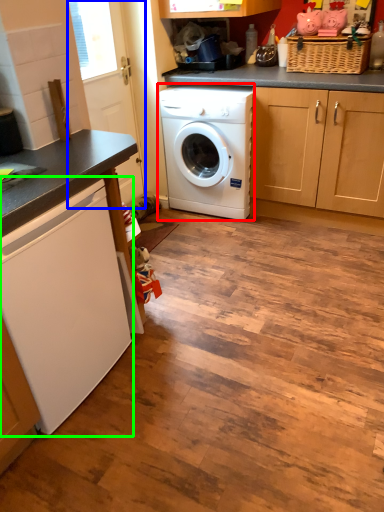
Question: Considering the real-world distances, which object is farthest from washing machine (highlighted by a red box)? screen door (highlighted by a blue box) or washing machine (highlighted by a green box)?

Choices:
 (A) screen door
 (B) washing machine

Answer: (B)